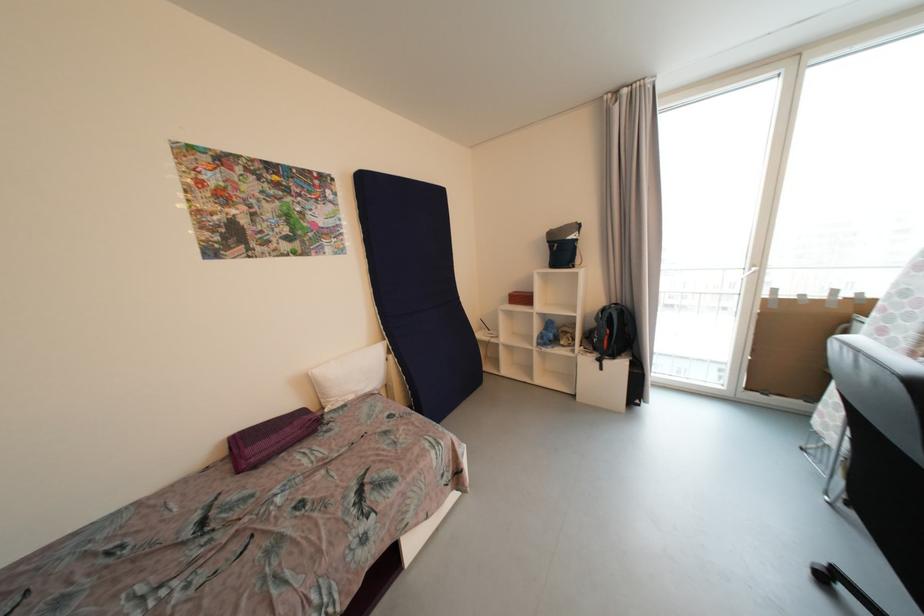
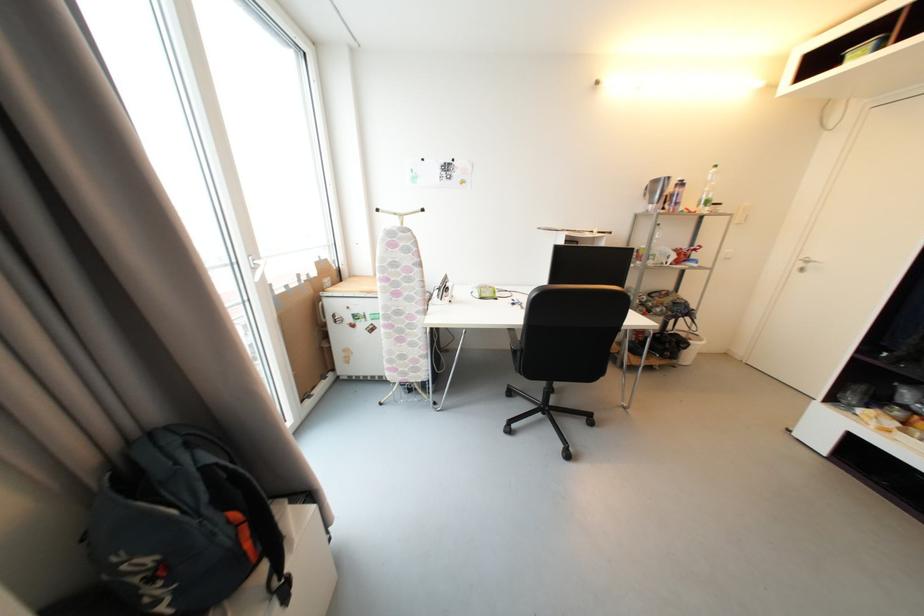
Where in the second image is the point corresponding to point 861,326 from the first image?

(330, 302)